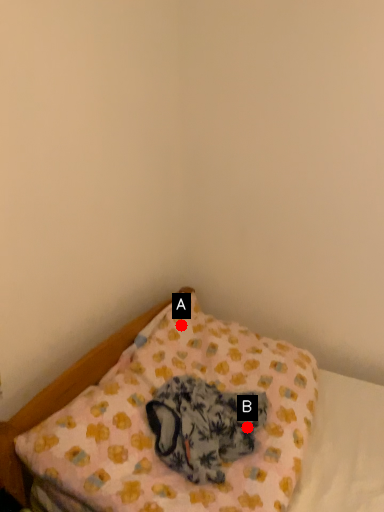
Question: Two points are circled on the image, labeled by A and B beside each circle. Which point is further to the camera?

Choices:
 (A) A is further
 (B) B is further

Answer: (A)